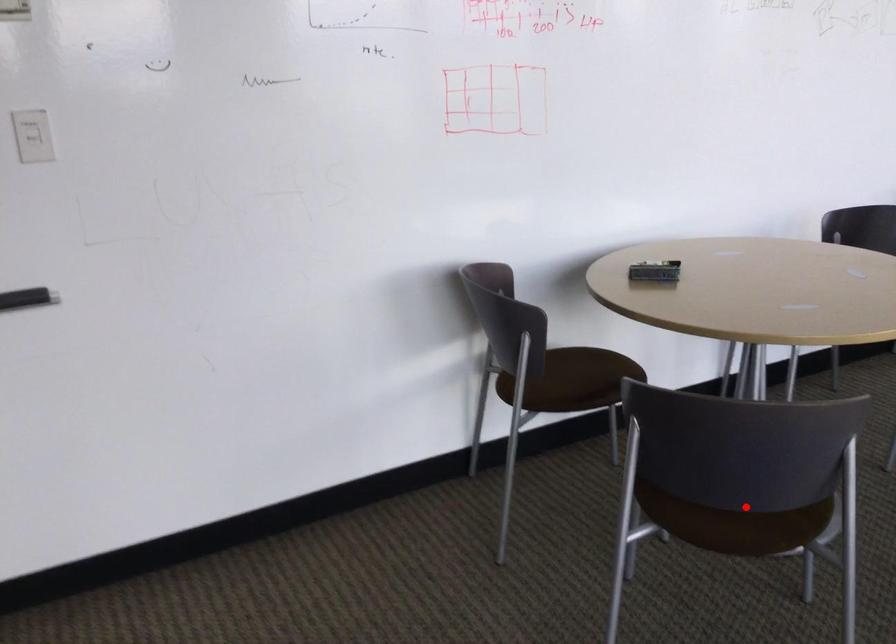
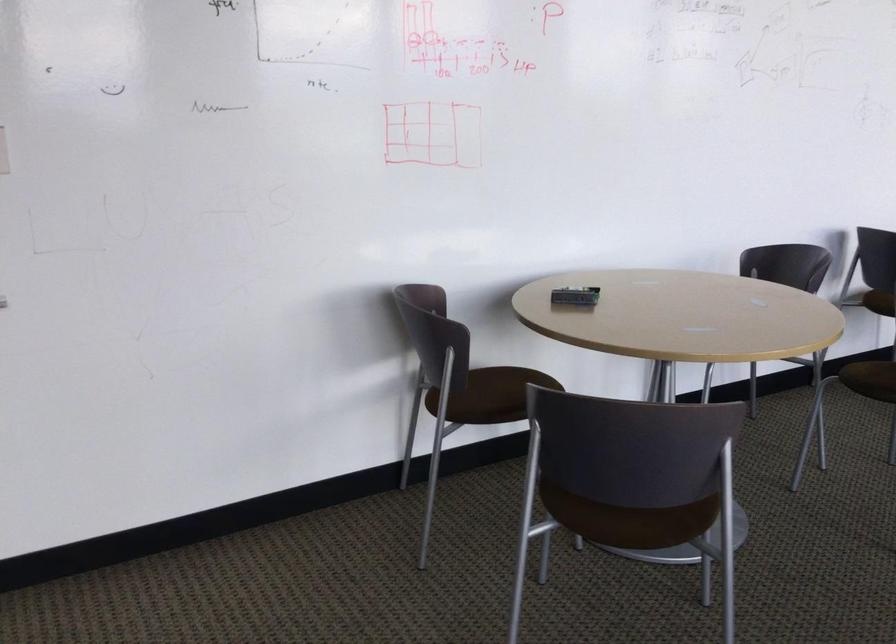
Question: I am providing you with two images of the same scene from different viewpoints. Image1 has a red point marked. In image2, the corresponding 3D location appears at what relative position? Reply with the corresponding letter.

Choices:
 (A) Closer
 (B) Farther

Answer: (B)